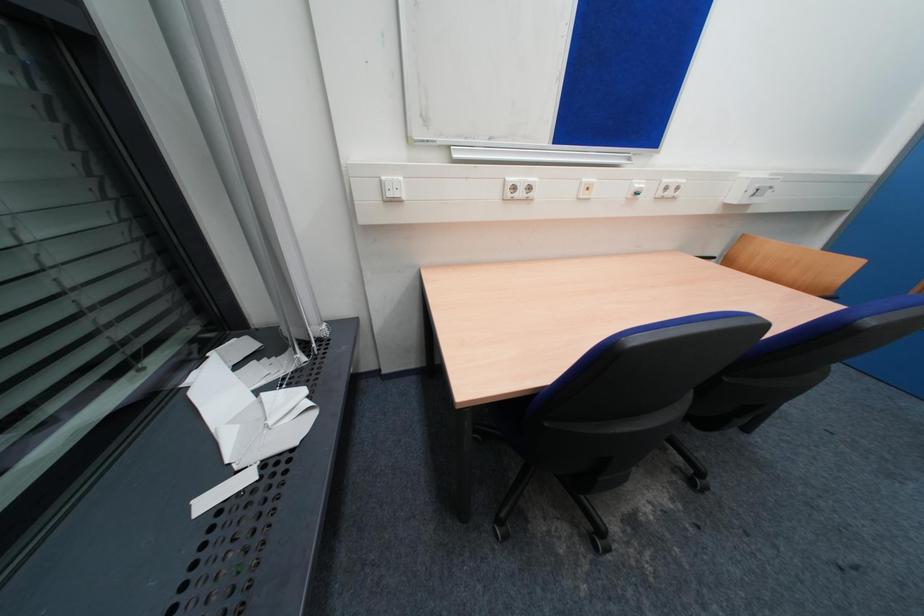
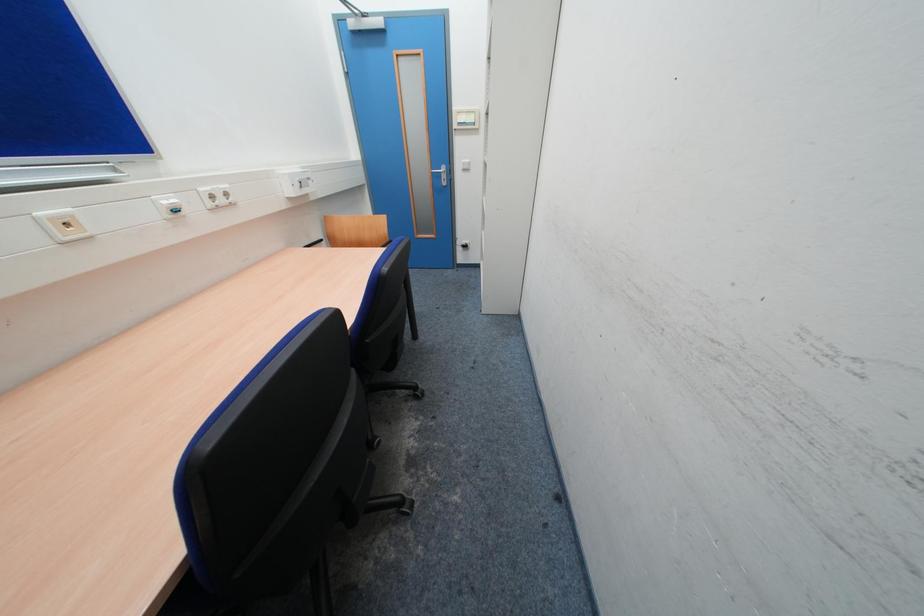
The first image is from the beginning of the video and the second image is from the end. How did the camera likely rotate when shooting the video?

The rotation direction of the camera is right-down.